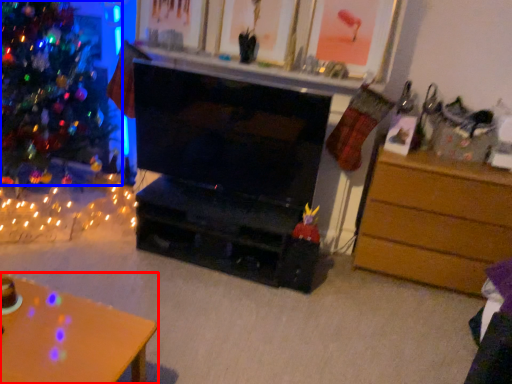
Question: Which of the following is the farthest to the observer, desk (highlighted by a red box) or christmas tree (highlighted by a blue box)?

Choices:
 (A) desk
 (B) christmas tree

Answer: (B)